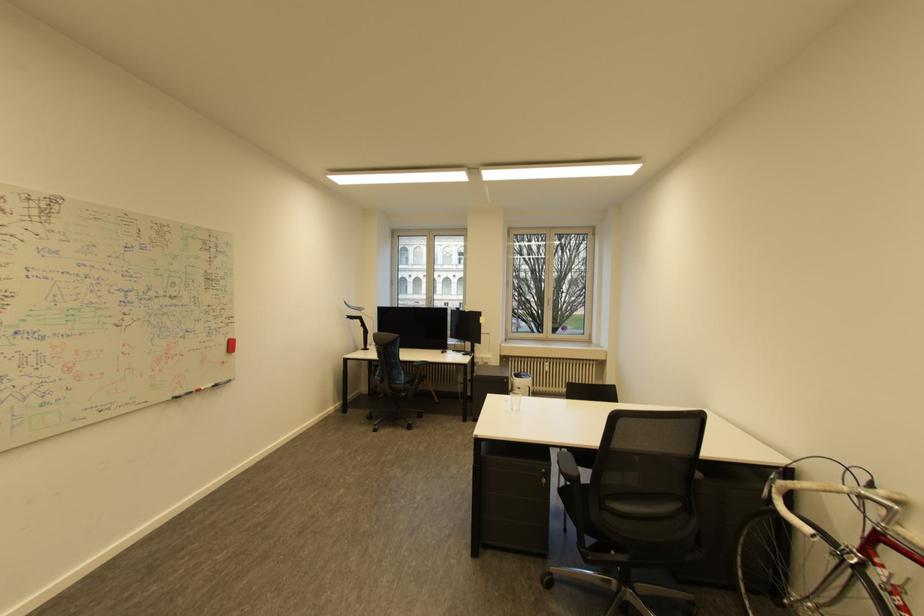
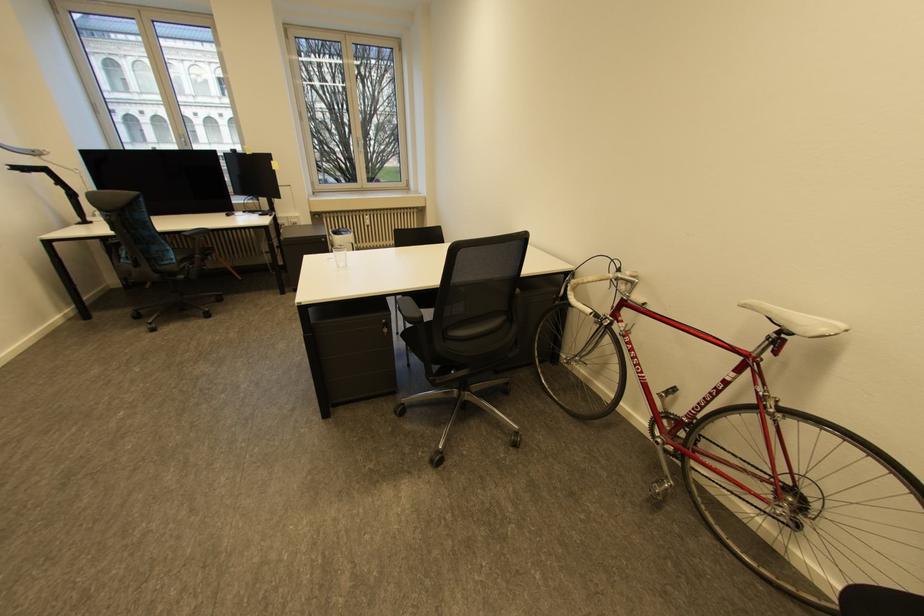
Locate, in the second image, the point that corresponds to the point at 553,373 in the first image.

(374, 227)